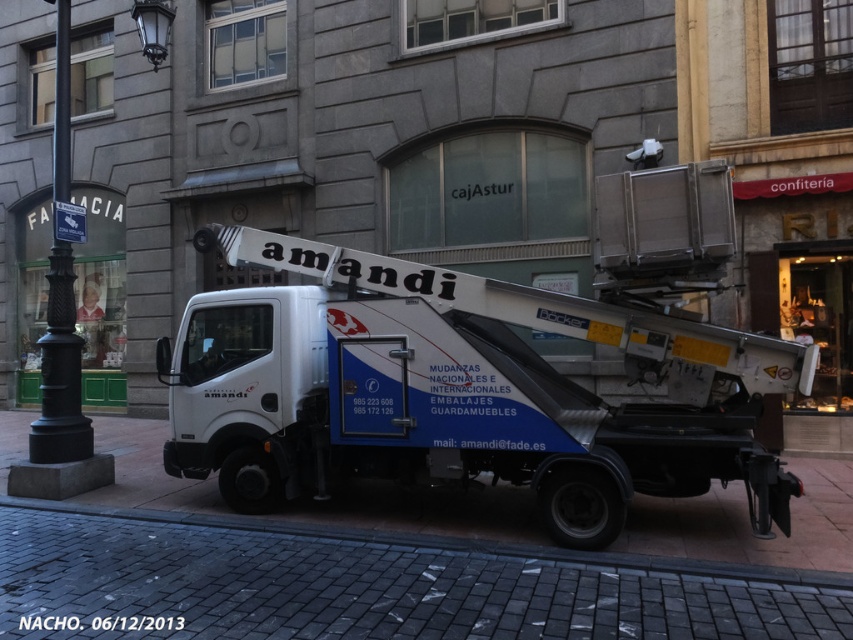
Question: Which point appears farthest from the camera in this image?

Choices:
 (A) (488, 616)
 (B) (57, 269)
 (C) (467, 372)

Answer: (B)

Question: Is gray cobblestone pavement at center wider than black metal lamp post at left?

Choices:
 (A) yes
 (B) no

Answer: (A)

Question: Observing the image, what is the correct spatial positioning of gray cobblestone pavement at center in reference to black metal lamp post at left?

Choices:
 (A) left
 (B) right

Answer: (B)

Question: Can you confirm if black metal lamp post at left is wider than black cast iron pole at left?

Choices:
 (A) yes
 (B) no

Answer: (B)

Question: Which point is farther from the camera taking this photo?

Choices:
 (A) (306, 608)
 (B) (50, 474)
 (C) (70, 353)
 (D) (347, 420)

Answer: (C)

Question: Which object is farther from the camera taking this photo?

Choices:
 (A) white metallic truck at center
 (B) gray cobblestone pavement at center
 (C) black metal lamp post at left
 (D) black cast iron pole at left

Answer: (C)